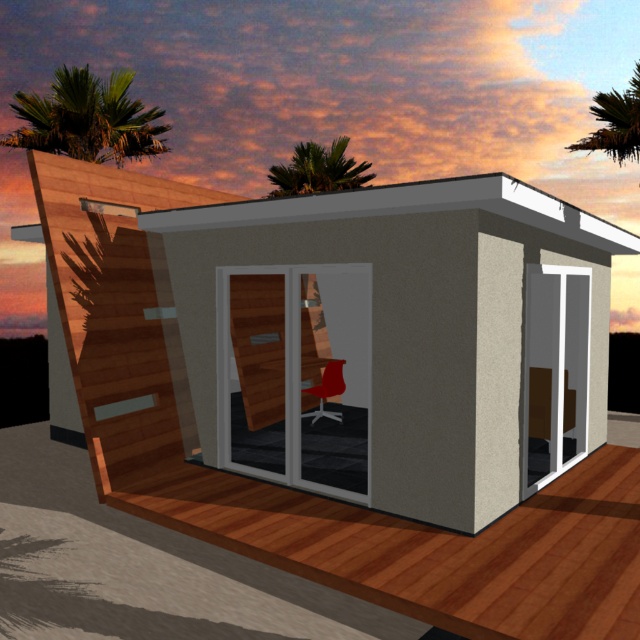
Is the position of green leafy palm tree at upper left more distant than that of green leafy palm tree at upper center?

No, it is not.

Between point (88, 124) and point (326, 160), which one is positioned behind?

Point (326, 160)

Where is `green leafy palm tree at upper left`? green leafy palm tree at upper left is located at coordinates (88, 118).

This screenshot has width=640, height=640. I want to click on green leafy palm tree at upper left, so click(88, 118).

Does green leafy palm tree at upper center have a lesser height compared to green leafy palm tree at upper right?

Yes, green leafy palm tree at upper center is shorter than green leafy palm tree at upper right.

Which is more to the right, green leafy palm tree at upper center or green leafy palm tree at upper right?

Positioned to the right is green leafy palm tree at upper right.

Between point (292, 177) and point (620, 106), which one is positioned behind?

The point (292, 177) is behind.

In order to click on green leafy palm tree at upper center in this screenshot , I will do `click(317, 170)`.

Looking at this image, is wooden hut at center to the left of green leafy palm tree at upper right from the viewer's perspective?

Yes, wooden hut at center is to the left of green leafy palm tree at upper right.

Between wooden hut at center and green leafy palm tree at upper right, which one appears on the right side from the viewer's perspective?

Positioned to the right is green leafy palm tree at upper right.

Where is `wooden hut at center`? wooden hut at center is located at coordinates (333, 333).